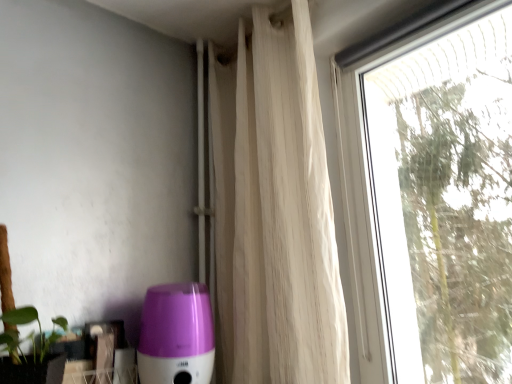
Question: Is transparent glass window at right wider or thinner than white sheer curtain at upper right?

Choices:
 (A) thin
 (B) wide

Answer: (A)

Question: Considering the positions of point (412, 253) and point (214, 79), is point (412, 253) closer or farther from the camera than point (214, 79)?

Choices:
 (A) closer
 (B) farther

Answer: (A)

Question: Estimate the real-world distances between objects in this image. Which object is farther from the white sheer curtain at upper right?

Choices:
 (A) transparent glass window at right
 (B) purple glossy humidifier at lower left

Answer: (A)

Question: Which object is positioned farthest from the transparent glass window at right?

Choices:
 (A) white sheer curtain at upper right
 (B) purple glossy humidifier at lower left

Answer: (B)